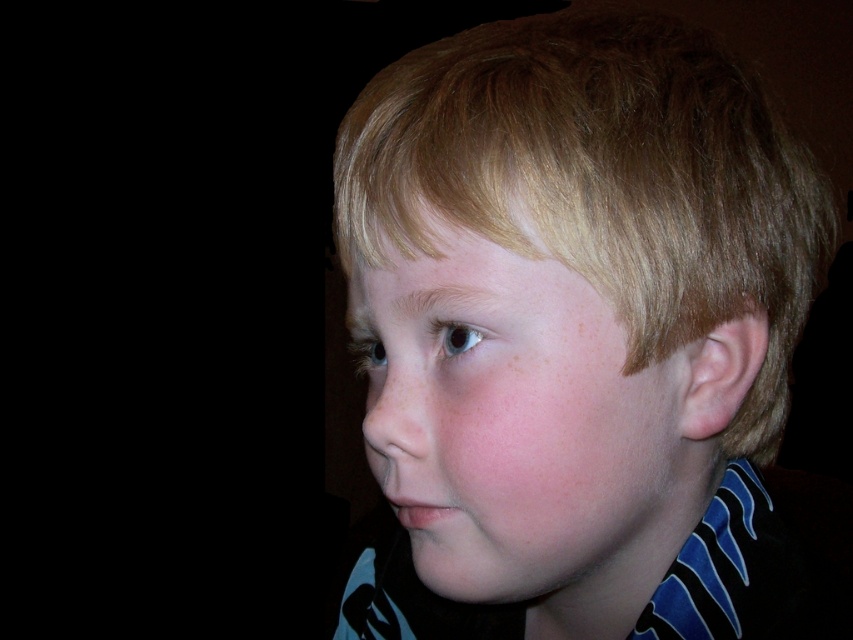
Based on the description, can you determine if the smooth skin face at center is wider than the pink matte freckle at upper center?

The smooth skin face at center is wider than the pink matte freckle at upper center according to the description.

You are a photographer trying to capture a closeup of the child in the image. You need to ensure that both the smooth skin child at center and the smooth skin face at center are clearly visible. Based on their sizes, which one might require more careful focusing to avoid blurriness?

The smooth skin face at center is smaller than the smooth skin child at center, so it might require more careful focusing to avoid blurriness due to its smaller size.